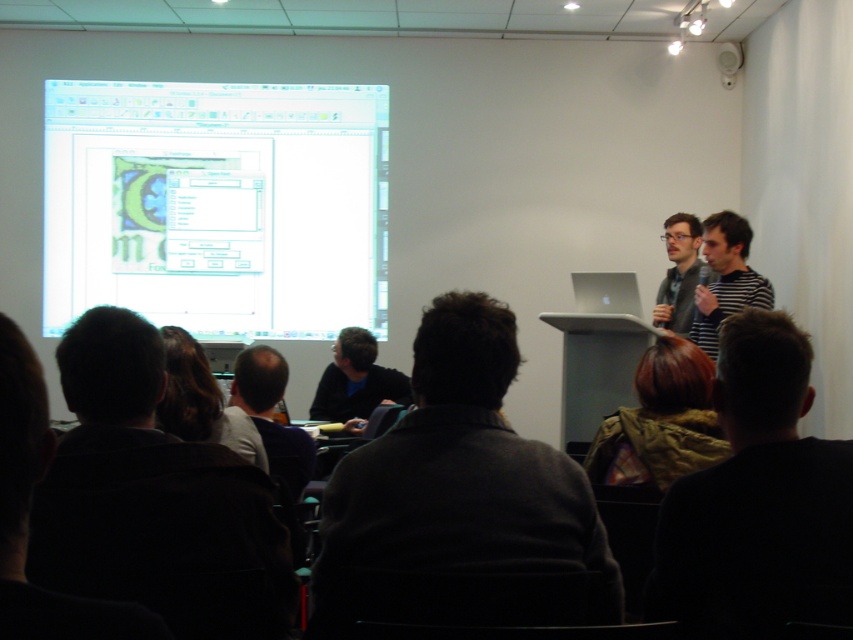
Is matte plastic projector screen at upper left to the right of dark gray sweater at center from the viewer's perspective?

In fact, matte plastic projector screen at upper left is to the left of dark gray sweater at center.

Which is behind, point (380, 154) or point (474, 307)?

The point (380, 154) is more distant.

I want to click on matte plastic projector screen at upper left, so click(218, 205).

Is striped shirt at right further to the viewer compared to matte black laptop at right?

No.

Consider the image. Who is lower down, striped shirt at right or matte black laptop at right?

striped shirt at right

Is point (712, 296) more distant than point (660, 285)?

No, (712, 296) is closer to viewer.

I want to click on striped shirt at right, so click(724, 278).

Is dark gray hair at lower center to the right of matte black laptop at right from the viewer's perspective?

Incorrect, dark gray hair at lower center is not on the right side of matte black laptop at right.

Does point (167, 353) come behind point (677, 253)?

No, it is not.

Based on the photo, who is more forward, (170, 378) or (689, 280)?

Point (170, 378) is more forward.

This screenshot has width=853, height=640. In order to click on dark gray hair at lower center in this screenshot , I will do `click(201, 401)`.